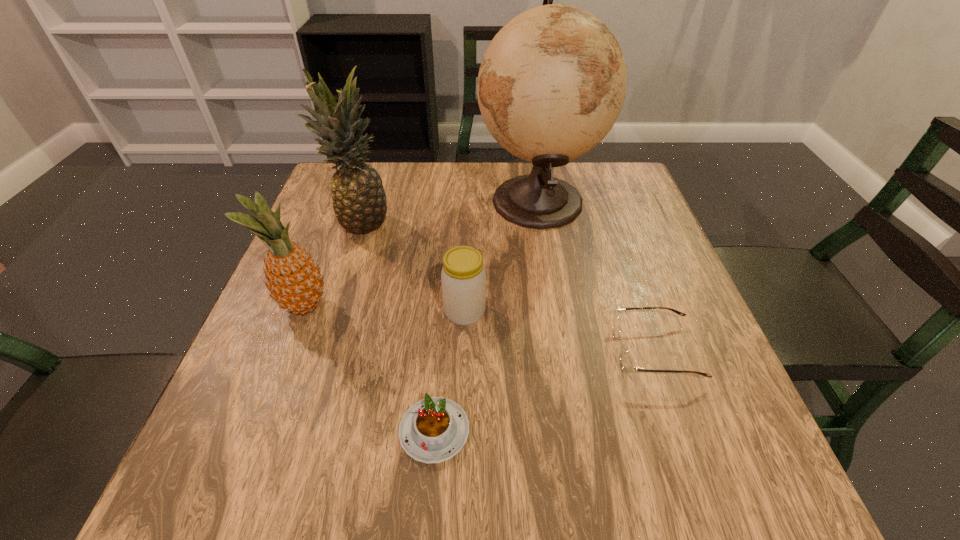
You are a GUI agent. You are given a task and a screenshot of the screen. Output one action in this format:
    pyautogui.click(x=<x>, y=<y>)
    Task: Click on the pineapple present at the far edge
    The height and width of the screenshot is (540, 960).
    Given the screenshot: What is the action you would take?
    pyautogui.click(x=358, y=197)

Find the location of `object positioned at the near edge`. object positioned at the near edge is located at coordinates (433, 430).

Identify the location of globe situated at the right edge. click(x=552, y=83).

Locate an element on the screen. spectacles present at the right edge is located at coordinates (627, 365).

Find the location of `object located at the far left corner`. object located at the far left corner is located at coordinates (358, 197).

The width and height of the screenshot is (960, 540). I want to click on object present at the far right corner, so click(552, 83).

In the image, there is a desktop. Identify the location of vacant space at the far edge. The height and width of the screenshot is (540, 960). (482, 166).

Find the location of `vacant region at the near edge of the desktop`. vacant region at the near edge of the desktop is located at coordinates (317, 460).

In the image, there is a desktop. At what (x,y) coordinates should I click in order to perform the action: click on free space at the left edge. Please return your answer as a coordinate pair (x, y). Looking at the image, I should click on (328, 233).

This screenshot has height=540, width=960. Identify the location of vacant point at the right edge. (687, 390).